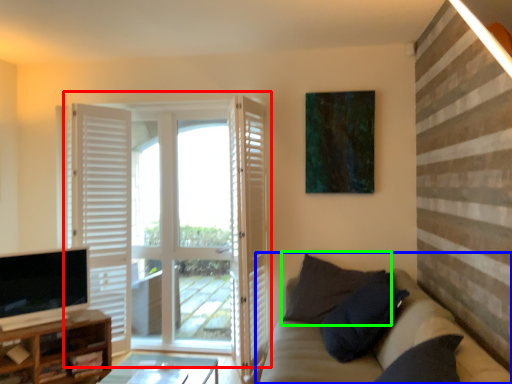
Question: Estimate the real-world distances between objects in this image. Which object is closer to door (highlighted by a red box), studio couch (highlighted by a blue box) or pillow (highlighted by a green box)?

Choices:
 (A) studio couch
 (B) pillow

Answer: (B)